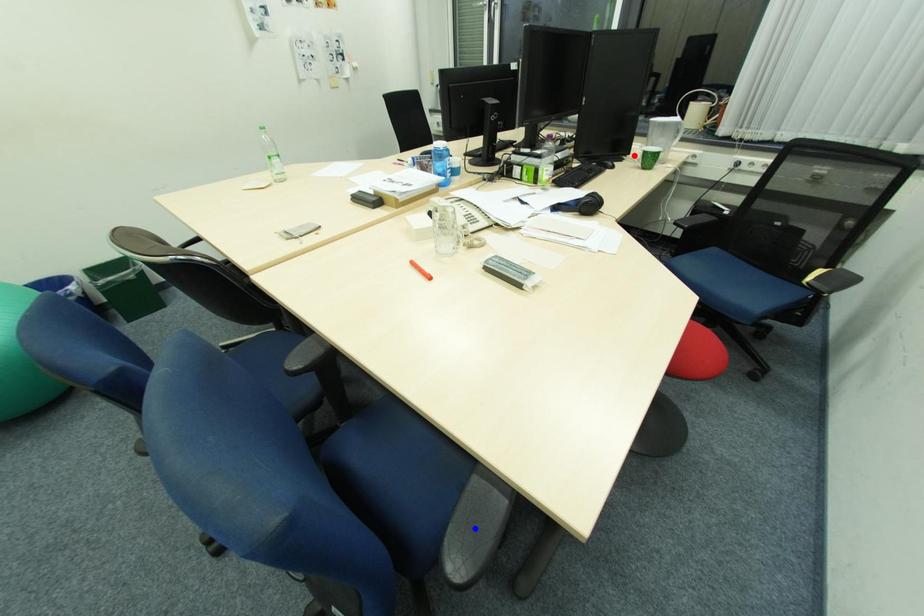
Question: Two points are marked on the image. Which point is closer to the camera?

Choices:
 (A) Blue point is closer.
 (B) Red point is closer.

Answer: (A)